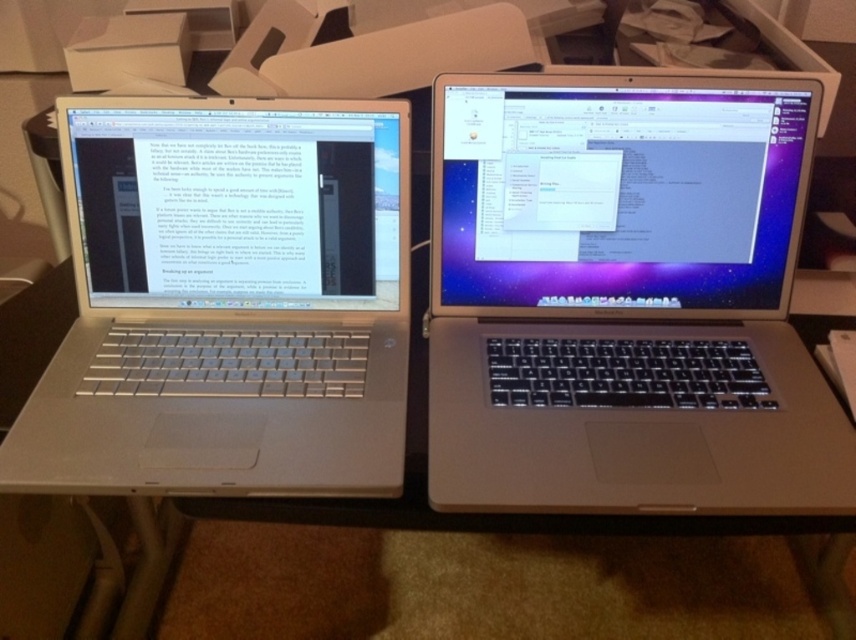
Does silver metallic laptop at left have a greater height compared to silver metallic desk at center?

Yes, silver metallic laptop at left is taller than silver metallic desk at center.

Describe the element at coordinates (227, 301) in the screenshot. The height and width of the screenshot is (640, 856). I see `silver metallic laptop at left` at that location.

What do you see at coordinates (227, 301) in the screenshot? This screenshot has height=640, width=856. I see `silver metallic laptop at left` at bounding box center [227, 301].

You are a GUI agent. You are given a task and a screenshot of the screen. Output one action in this format:
    pyautogui.click(x=<x>, y=<y>)
    Task: Click on the silver metallic laptop at left
    The height and width of the screenshot is (640, 856).
    Given the screenshot: What is the action you would take?
    click(x=227, y=301)

Does satin silver laptop at center appear on the right side of silver metallic desk at center?

Yes, satin silver laptop at center is to the right of silver metallic desk at center.

Is point (592, 497) positioned in front of point (415, 301)?

Yes, point (592, 497) is closer to viewer.

Image resolution: width=856 pixels, height=640 pixels. Find the location of `satin silver laptop at center`. satin silver laptop at center is located at coordinates (623, 298).

Can you confirm if satin silver laptop at center is wider than silver metallic laptop at left?

Correct, the width of satin silver laptop at center exceeds that of silver metallic laptop at left.

Can you confirm if satin silver laptop at center is taller than silver metallic laptop at left?

Yes, satin silver laptop at center is taller than silver metallic laptop at left.

Is point (598, 93) positioned in front of point (342, 282)?

That is True.

The image size is (856, 640). I want to click on satin silver laptop at center, so click(623, 298).